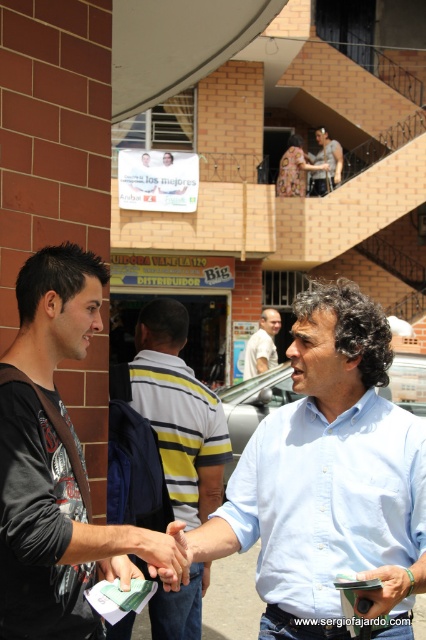
Question: Is yellow striped shirt at center bigger than smooth leather wallet at lower right?

Choices:
 (A) yes
 (B) no

Answer: (A)

Question: Among these objects, which one is farthest from the camera?

Choices:
 (A) black matte shirt at left
 (B) matte black hand at center
 (C) matte black shirt at center

Answer: (C)

Question: Can you confirm if smooth leather wallet at lower right is wider than smooth white paper at center?

Choices:
 (A) no
 (B) yes

Answer: (B)

Question: Which object is farther from the camera taking this photo?

Choices:
 (A) white cotton shirt at center
 (B) black matte shirt at left
 (C) yellow striped shirt at center

Answer: (A)

Question: Which of these objects is positioned closest to the white cotton shirt at center?

Choices:
 (A) matte black hand at center
 (B) yellow striped shirt at center
 (C) smooth white paper at center
 (D) light blue button-down shirt at center

Answer: (B)

Question: Is yellow striped shirt at center positioned behind smooth white paper at center?

Choices:
 (A) no
 (B) yes

Answer: (B)